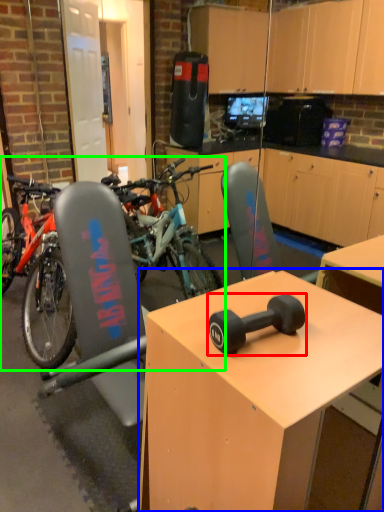
Question: Considering the real-world distances, which object is closest to dumbbell (highlighted by a red box)? desk (highlighted by a blue box) or mountain bike (highlighted by a green box).

Choices:
 (A) desk
 (B) mountain bike

Answer: (A)